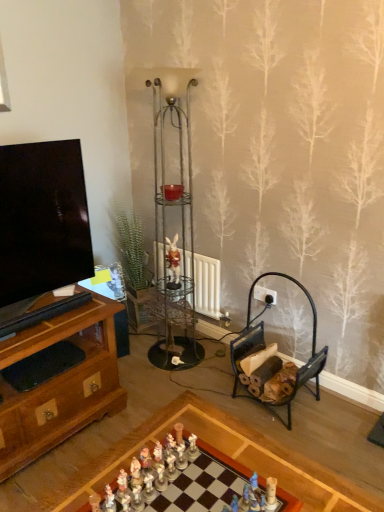
The image size is (384, 512). I want to click on vacant space that is to the left of matte blue figurine at center, arranged as the first toy when viewed from the front, so click(x=197, y=495).